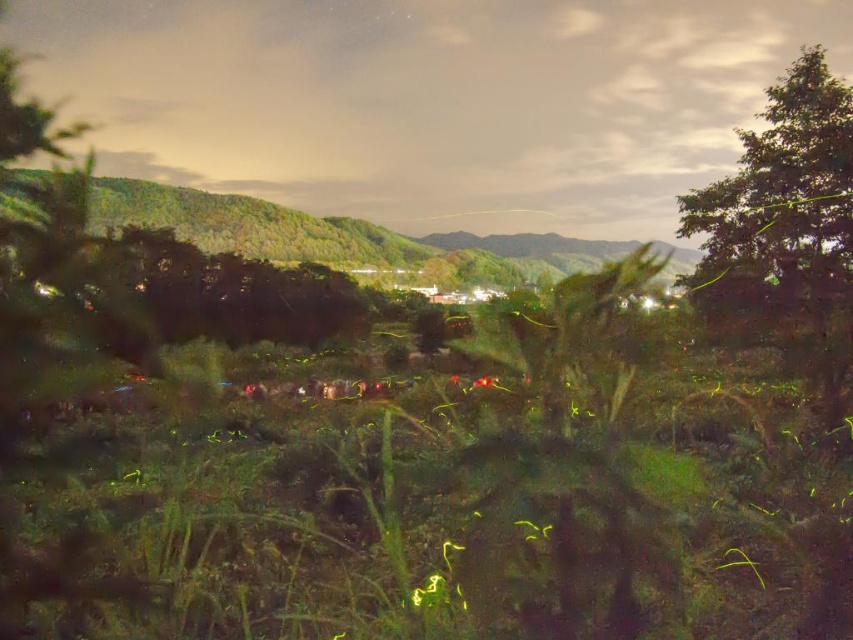
Question: Is green leafy tree at upper right positioned before green leafy hillside at upper left?

Choices:
 (A) yes
 (B) no

Answer: (A)

Question: Which object appears closest to the camera in this image?

Choices:
 (A) green leafy tree at upper right
 (B) green leafy hillside at upper left

Answer: (A)

Question: Estimate the real-world distances between objects in this image. Which object is closer to the green leafy hillside at upper left?

Choices:
 (A) green grass at center
 (B) green leafy tree at upper right

Answer: (A)

Question: Is green leafy tree at upper right in front of green leafy hillside at upper left?

Choices:
 (A) yes
 (B) no

Answer: (A)

Question: Which is nearer to the green leafy hillside at upper left?

Choices:
 (A) green leafy tree at upper right
 (B) green grass at center

Answer: (B)

Question: Can you confirm if green leafy tree at upper right is positioned above green leafy hillside at upper left?

Choices:
 (A) no
 (B) yes

Answer: (A)